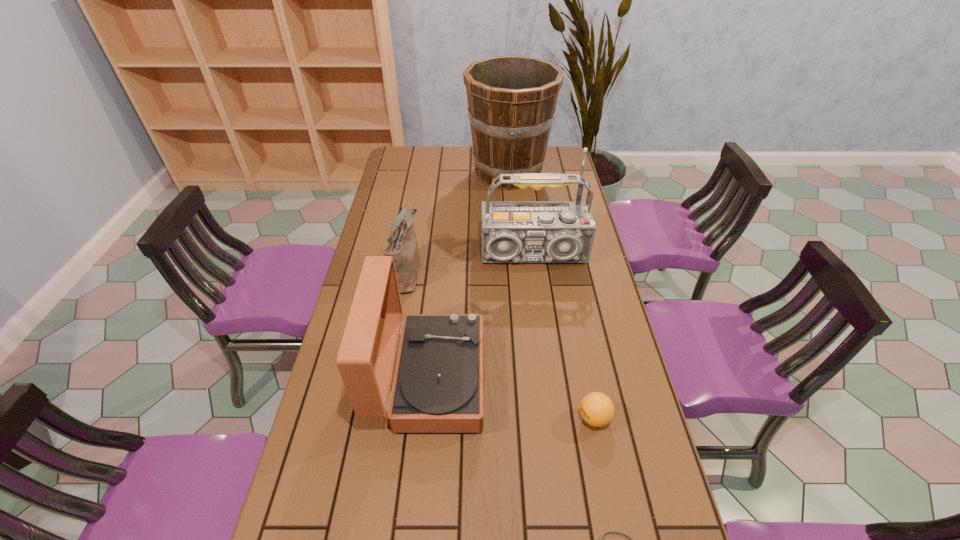
The image size is (960, 540). I want to click on vacant space that satisfies the following two spatial constraints: 1. on the front-facing side of the second tallest object; 2. on the face of the phonograph record, so click(550, 379).

I want to click on free space in the image that satisfies the following two spatial constraints: 1. on the front-facing side of the radio receiver; 2. on the face of the phonograph record, so click(x=550, y=379).